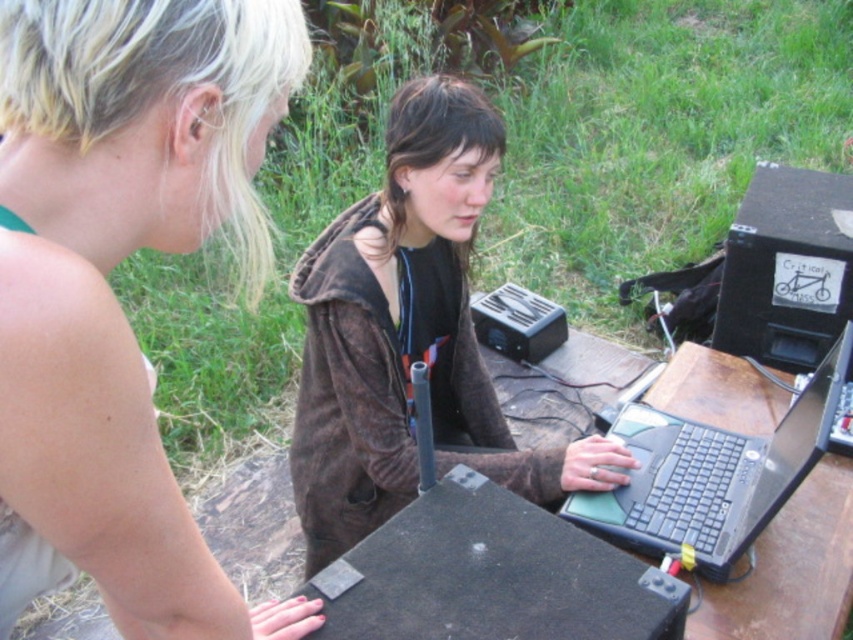
Between brown suede jacket at center and black plastic laptop at center, which one has more height?

With more height is brown suede jacket at center.

Which is above, brown suede jacket at center or black plastic laptop at center?

Positioned higher is brown suede jacket at center.

You are a GUI agent. You are given a task and a screenshot of the screen. Output one action in this format:
    pyautogui.click(x=<x>, y=<y>)
    Task: Click on the brown suede jacket at center
    The image size is (853, 640).
    Given the screenshot: What is the action you would take?
    pyautogui.click(x=410, y=336)

Can you confirm if blonde hair at upper left is positioned above brown suede jacket at center?

Correct, blonde hair at upper left is located above brown suede jacket at center.

Is point (143, 474) positioned after point (434, 403)?

No, it is in front of (434, 403).

Who is more forward, (152, 451) or (401, 264)?

Point (152, 451)

Locate an element on the screen. The height and width of the screenshot is (640, 853). blonde hair at upper left is located at coordinates (109, 269).

Measure the distance from blonde hair at upper left to black plastic laptop at center.

A distance of 31.31 inches exists between blonde hair at upper left and black plastic laptop at center.

Who is more forward, (125, 65) or (666, 440)?

Positioned in front is point (125, 65).

Is point (22, 468) more distant than point (809, 429)?

That is False.

You are a GUI agent. You are given a task and a screenshot of the screen. Output one action in this format:
    pyautogui.click(x=<x>, y=<y>)
    Task: Click on the blonde hair at upper left
    
    Given the screenshot: What is the action you would take?
    pyautogui.click(x=109, y=269)